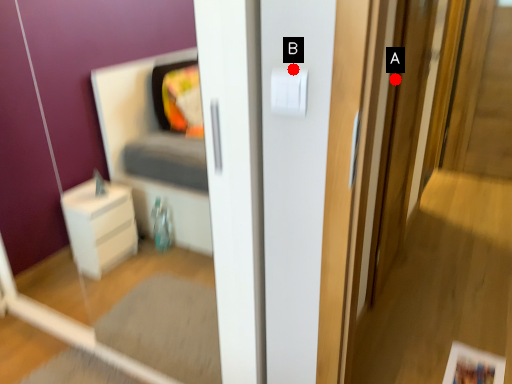
Question: Two points are circled on the image, labeled by A and B beside each circle. Which point is closer to the camera taking this photo?

Choices:
 (A) A is closer
 (B) B is closer

Answer: (B)